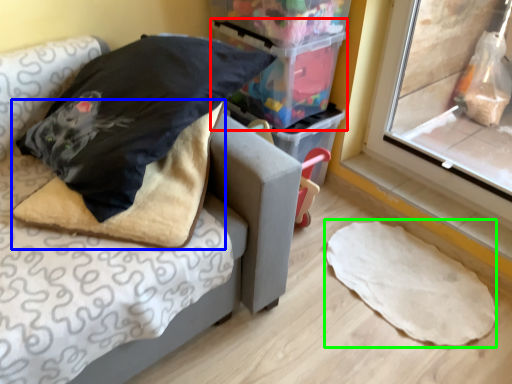
Question: Estimate the real-world distances between objects in this image. Which object is closer to storage box (highlighted by a red box), blanket (highlighted by a blue box) or linen (highlighted by a green box)?

Choices:
 (A) blanket
 (B) linen

Answer: (A)